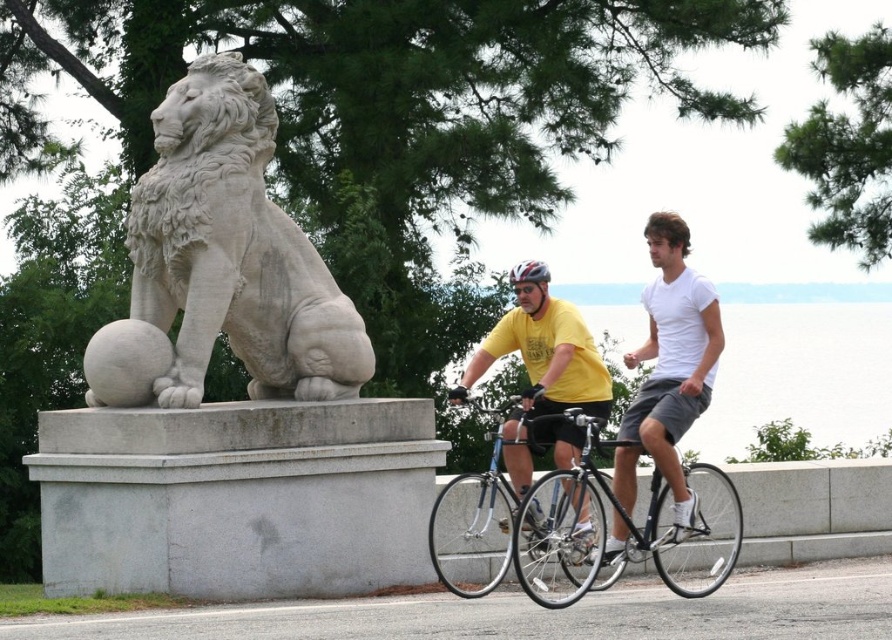
Question: Is white cotton shirt at center smaller than matte black bicycle helmet at center?

Choices:
 (A) no
 (B) yes

Answer: (A)

Question: Which of the following is the closest to the observer?

Choices:
 (A) black matte bicycle at center
 (B) matte black bicycle helmet at center

Answer: (A)

Question: Does white cotton shirt at center lie in front of matte black bicycle helmet at center?

Choices:
 (A) yes
 (B) no

Answer: (A)

Question: Which object is positioned closest to the white stone lion at left?

Choices:
 (A) shiny blue frame at center
 (B) yellow matte shirt at center
 (C) white cotton shirt at center

Answer: (B)

Question: Among these objects, which one is farthest from the camera?

Choices:
 (A) matte black bicycle helmet at center
 (B) black matte bicycle at center
 (C) yellow matte shirt at center

Answer: (A)

Question: Can you confirm if white stone lion at left is positioned below black matte bicycle at center?

Choices:
 (A) no
 (B) yes

Answer: (A)